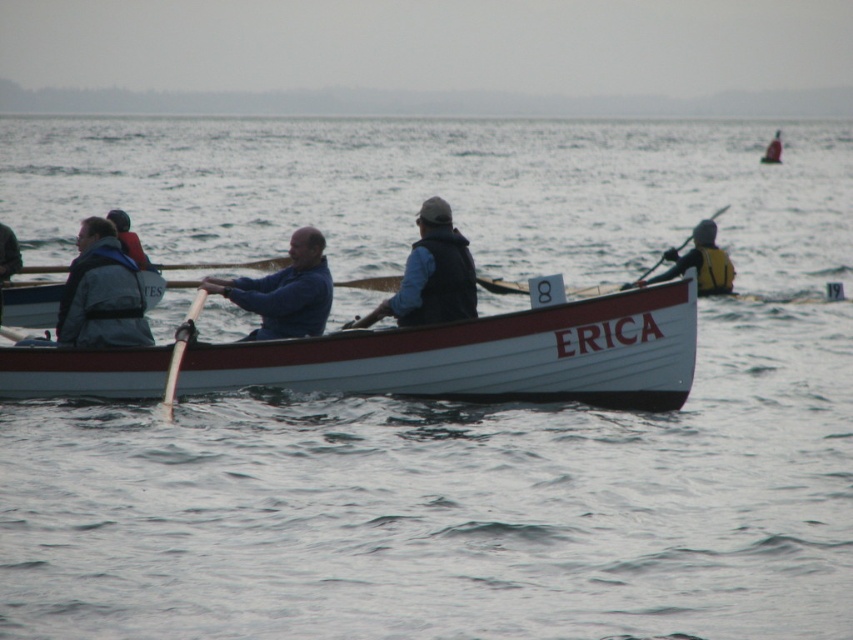
Does point (6, 273) come in front of point (764, 163)?

Yes, it is.

Is point (0, 234) farther from viewer compared to point (766, 154)?

No, it is in front of (766, 154).

Who is more forward, (x=0, y=289) or (x=773, y=145)?

Point (x=0, y=289) is more forward.

The width and height of the screenshot is (853, 640). Find the location of `gray fabric jacket at left`. gray fabric jacket at left is located at coordinates (7, 259).

Is blue matte jacket at center shorter than yellow life vest at upper right?

Yes, blue matte jacket at center is shorter than yellow life vest at upper right.

Which is more to the right, blue matte jacket at center or yellow life vest at upper right?

From the viewer's perspective, yellow life vest at upper right appears more on the right side.

Between point (308, 282) and point (779, 150), which one is positioned in front?

Point (308, 282) is more forward.

The width and height of the screenshot is (853, 640). Identify the location of blue matte jacket at center. (285, 291).

Is blue matte jacket at center to the right of white wood paddle at center from the viewer's perspective?

Indeed, blue matte jacket at center is positioned on the right side of white wood paddle at center.

Where is `blue matte jacket at center`? blue matte jacket at center is located at coordinates (285, 291).